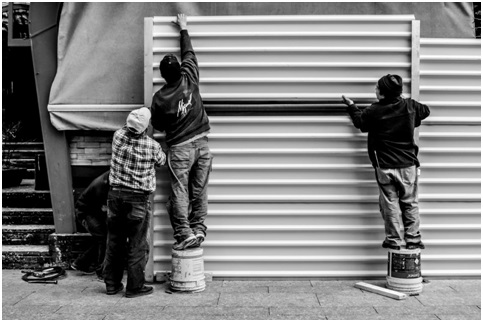
At what (x,y) coordinates should I click in order to perform the action: click on bucket. Please return your answer as a coordinate pair (x, y). Looking at the image, I should click on (189, 264).